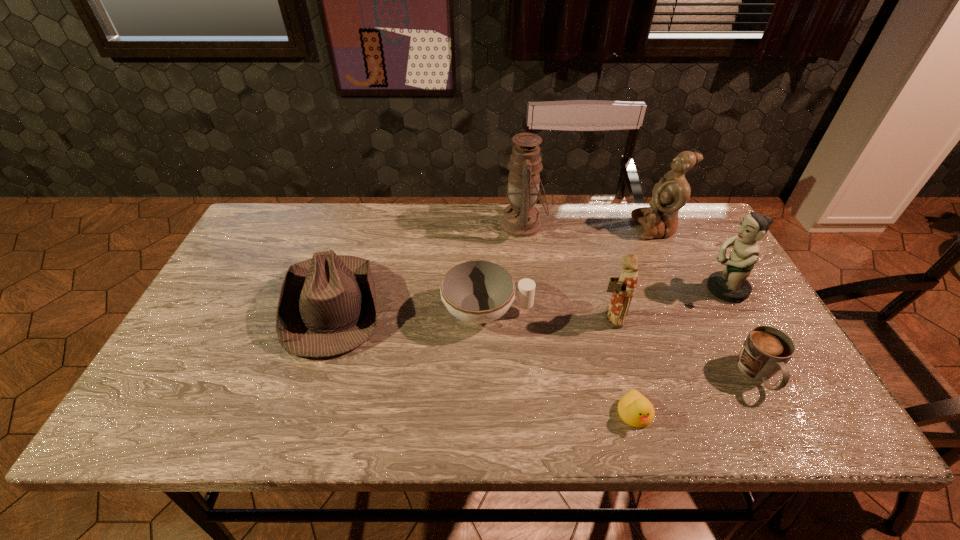
You are a GUI agent. You are given a task and a screenshot of the screen. Output one action in this format:
    pyautogui.click(x=<x>, y=<y>)
    Task: Click on the oil lamp
    This screenshot has height=540, width=960.
    Given the screenshot: What is the action you would take?
    pyautogui.click(x=520, y=219)

At what (x,y) coordinates should I click in order to perform the action: click on the farthest figurine. Please return your answer as a coordinate pair (x, y). This screenshot has height=540, width=960. Looking at the image, I should click on pos(671,193).

Identify the location of the second farthest figurine. This screenshot has height=540, width=960. (730, 285).

You are a GUI agent. You are given a task and a screenshot of the screen. Output one action in this format:
    pyautogui.click(x=<x>, y=<y>)
    Task: Click on the leftmost figurine
    
    Given the screenshot: What is the action you would take?
    pyautogui.click(x=623, y=288)

At what (x,y) coordinates should I click in order to perform the action: click on the fifth tallest object. Please return your answer as a coordinate pair (x, y). Image resolution: width=960 pixels, height=540 pixels. Looking at the image, I should click on (327, 306).

This screenshot has height=540, width=960. What are the coordinates of `fedora` in the screenshot? It's located at (327, 306).

Find the location of a particular element. The image size is (960, 540). chinaware is located at coordinates (477, 292).

The height and width of the screenshot is (540, 960). What are the coordinates of `mug` in the screenshot? It's located at (766, 350).

Identify the location of duckling. (636, 410).

This screenshot has height=540, width=960. Identify the location of free space located 0.340m on the right of the tallest object. (652, 225).